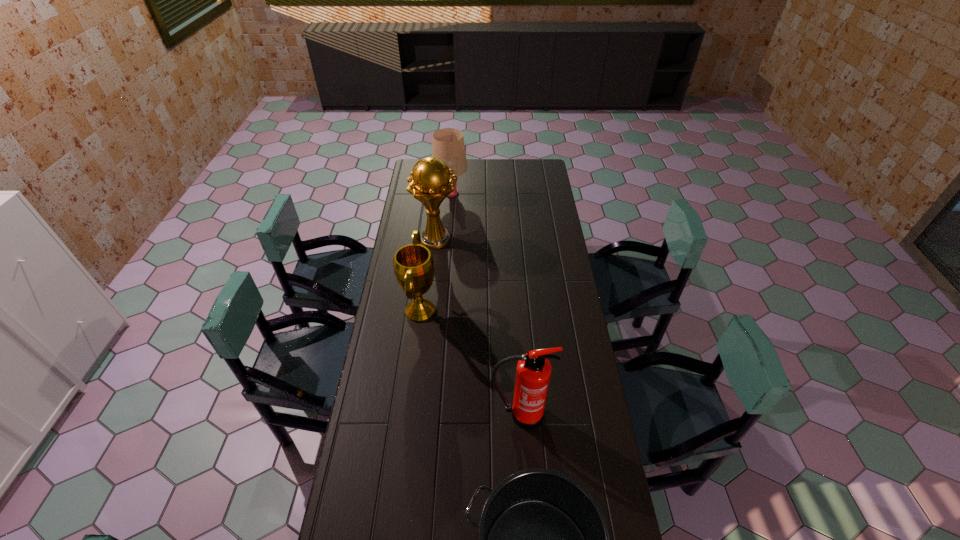
Find the location of a particular element. The image size is (960, 540). the second farthest object is located at coordinates 430,184.

Find the location of a particular element. Image resolution: width=960 pixels, height=540 pixels. fire extinguisher is located at coordinates (533, 373).

Where is `lampshade`? lampshade is located at coordinates (448, 145).

Find the location of `the third nearest object`. the third nearest object is located at coordinates (413, 264).

Find the location of a particular element. free region located 0.330m at the front of the second farthest object where the globe is prominent is located at coordinates (525, 239).

Identify the location of vacant space located at the nozzle of the fire extinguisher. The image size is (960, 540). (525, 497).

This screenshot has width=960, height=540. I want to click on free space located 0.160m on the front of the lampshade, so click(448, 221).

Where is `vacant area situated 0.080m on the front-facing side of the third nearest object`? vacant area situated 0.080m on the front-facing side of the third nearest object is located at coordinates (457, 310).

This screenshot has height=540, width=960. What are the coordinates of `trophy_cup that is at the left edge` in the screenshot? It's located at (430, 184).

Where is `lampshade present at the left edge`? lampshade present at the left edge is located at coordinates (448, 145).